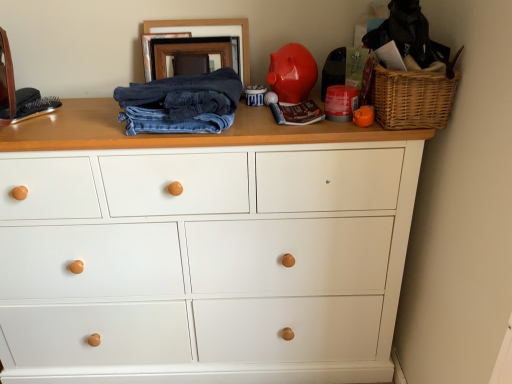
Where is `blank area to the left of dark blue denim jeans at center`? This screenshot has height=384, width=512. blank area to the left of dark blue denim jeans at center is located at coordinates (81, 132).